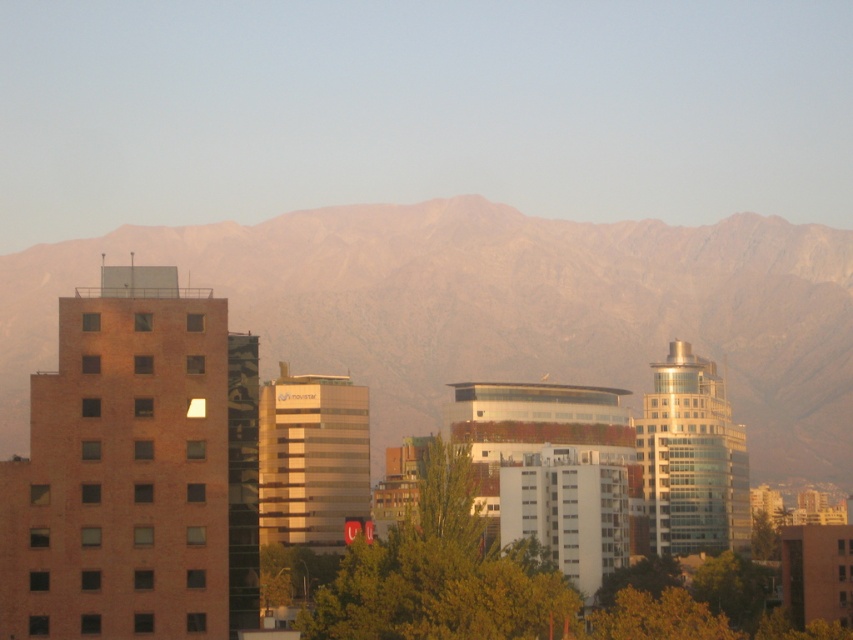
Is rocky brown mountain range at upper center thinner than green leafy tree at center?

No.

Is rocky brown mountain range at upper center smaller than green leafy tree at center?

Incorrect, rocky brown mountain range at upper center is not smaller in size than green leafy tree at center.

Is point (44, 339) closer to camera compared to point (451, 456)?

No, it is behind (451, 456).

The image size is (853, 640). I want to click on rocky brown mountain range at upper center, so click(496, 310).